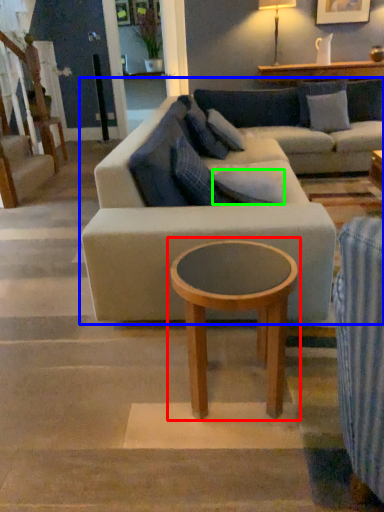
Question: Based on their relative distances, which object is farther from coffee table (highlighted by a red box)? Choose from studio couch (highlighted by a blue box) and pillow (highlighted by a green box).

Choices:
 (A) studio couch
 (B) pillow

Answer: (B)